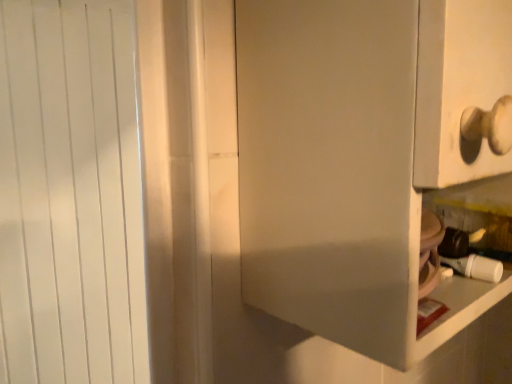
The height and width of the screenshot is (384, 512). Find the location of `white matte cabinet at right`. white matte cabinet at right is located at coordinates (330, 169).

Describe the element at coordinates (330, 169) in the screenshot. This screenshot has height=384, width=512. I see `white matte cabinet at right` at that location.

You are a GUI agent. You are given a task and a screenshot of the screen. Output one action in this format:
    pyautogui.click(x=<x>, y=<y>)
    Task: Click on the white matte cabinet at right
    The width and height of the screenshot is (512, 384).
    Given the screenshot: What is the action you would take?
    pyautogui.click(x=330, y=169)